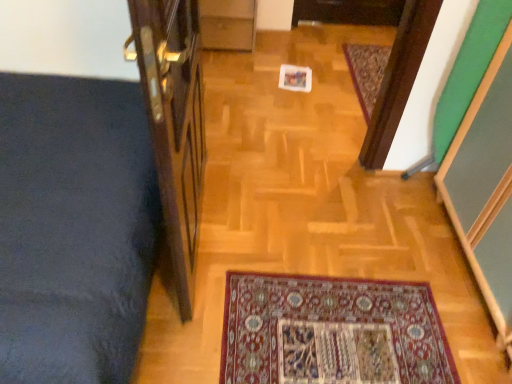
Where is `vacant space to the right of wooden door at left`? The width and height of the screenshot is (512, 384). vacant space to the right of wooden door at left is located at coordinates (291, 251).